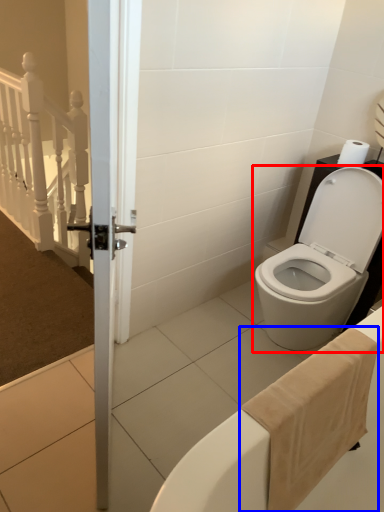
Question: Which of the following is the closest to the observer, toilet (highlighted by a red box) or bath towel (highlighted by a blue box)?

Choices:
 (A) toilet
 (B) bath towel

Answer: (B)